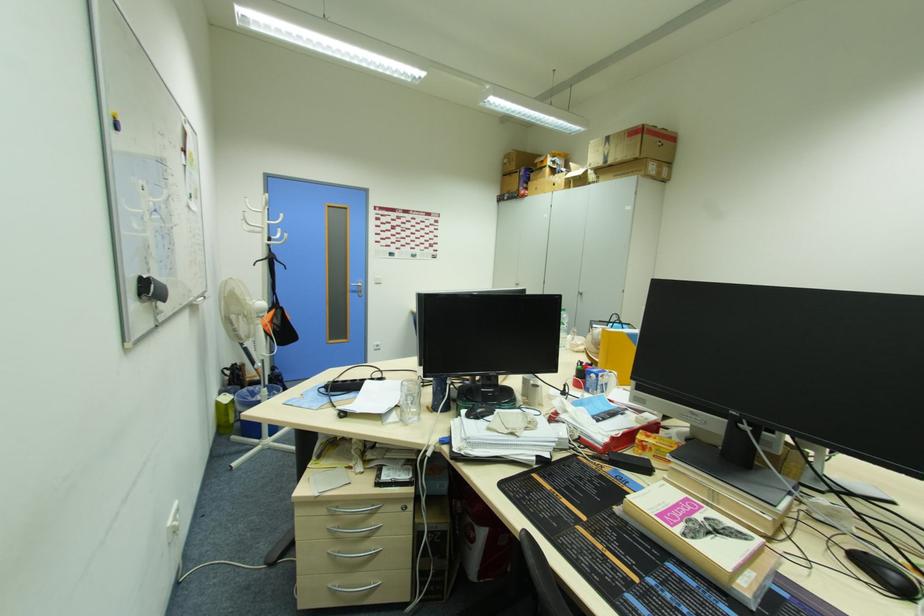
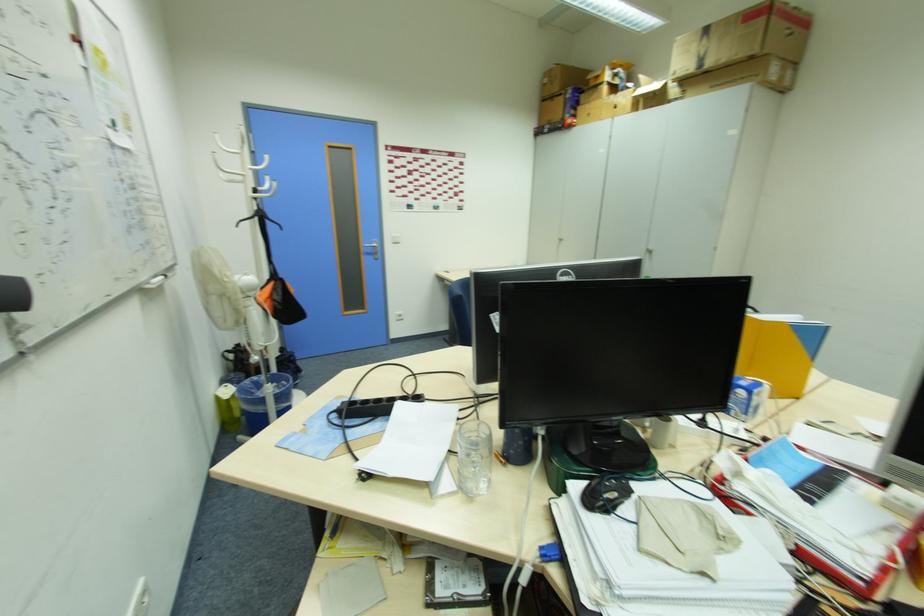
Locate, in the second image, the point that corresponds to point 487,410 in the first image.

(619, 496)